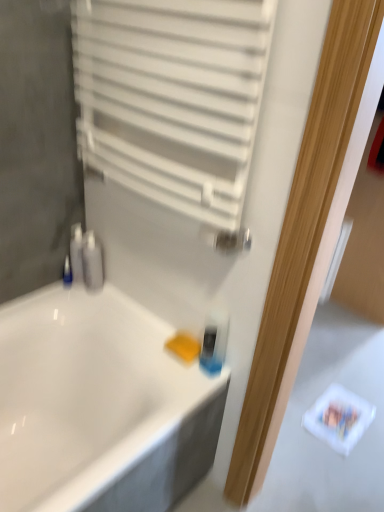
Find the location of a particular element. vacant region to the left of satin silver soap dispenser at left, positioned as the 2th toiletry in left-to-right order is located at coordinates (58, 296).